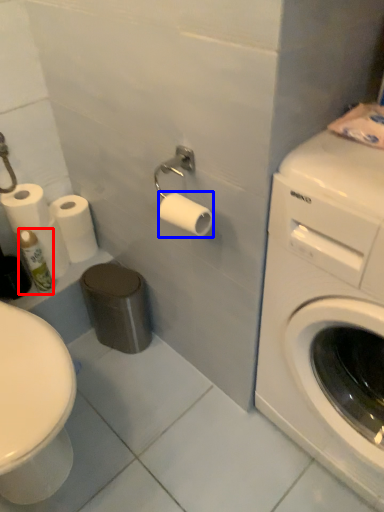
Question: Which object is closer to the camera taking this photo, toiletry (highlighted by a red box) or toilet paper (highlighted by a blue box)?

Choices:
 (A) toiletry
 (B) toilet paper

Answer: (B)